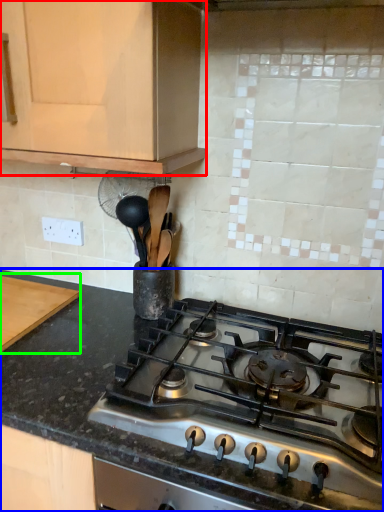
Question: Which is nearer to the cabinetry (highlighted by a red box)? countertop (highlighted by a blue box) or cutting board (highlighted by a green box).

Choices:
 (A) countertop
 (B) cutting board

Answer: (A)